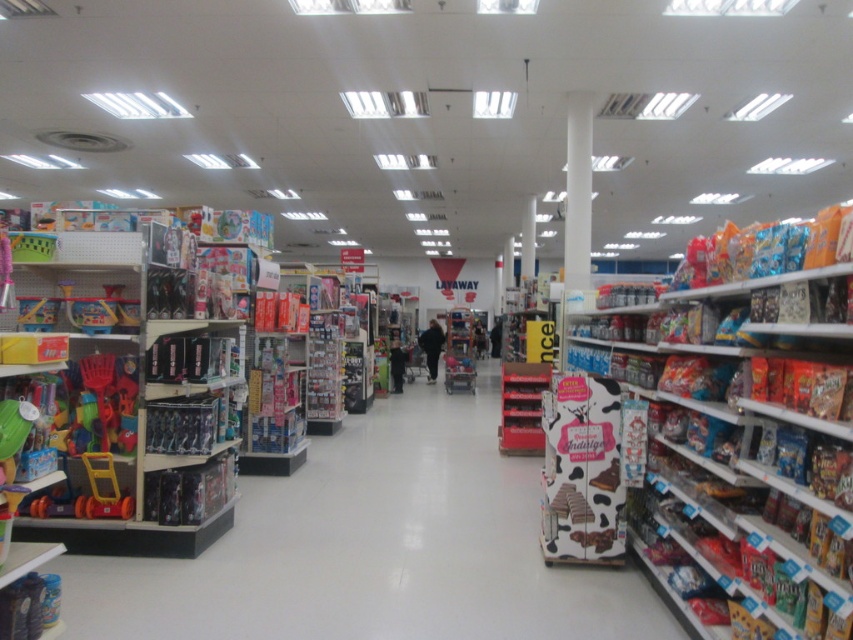
Is matte cardboard box at right positioned at the back of white smooth pillar at center?

No, matte cardboard box at right is in front of white smooth pillar at center.

Is matte cardboard box at right to the right of white smooth pillar at center from the viewer's perspective?

No, matte cardboard box at right is not to the right of white smooth pillar at center.

Who is more forward, (831,486) or (576,192)?

Point (831,486)

Locate an element on the screen. matte cardboard box at right is located at coordinates (743, 435).

Based on the photo, does matte cardboard box at right have a greater height compared to black fabric pants at center?

Correct, matte cardboard box at right is much taller as black fabric pants at center.

Does matte cardboard box at right lie behind black fabric pants at center?

No, matte cardboard box at right is closer to the viewer.

Between point (799, 625) and point (425, 352), which one is positioned behind?

Positioned behind is point (425, 352).

I want to click on matte cardboard box at right, so click(x=743, y=435).

Can you confirm if matte cardboard box at right is positioned above cow print cardboard at center?

Indeed, matte cardboard box at right is positioned over cow print cardboard at center.

Is matte cardboard box at right smaller than cow print cardboard at center?

No.

Locate an element on the screen. matte cardboard box at right is located at coordinates (743, 435).